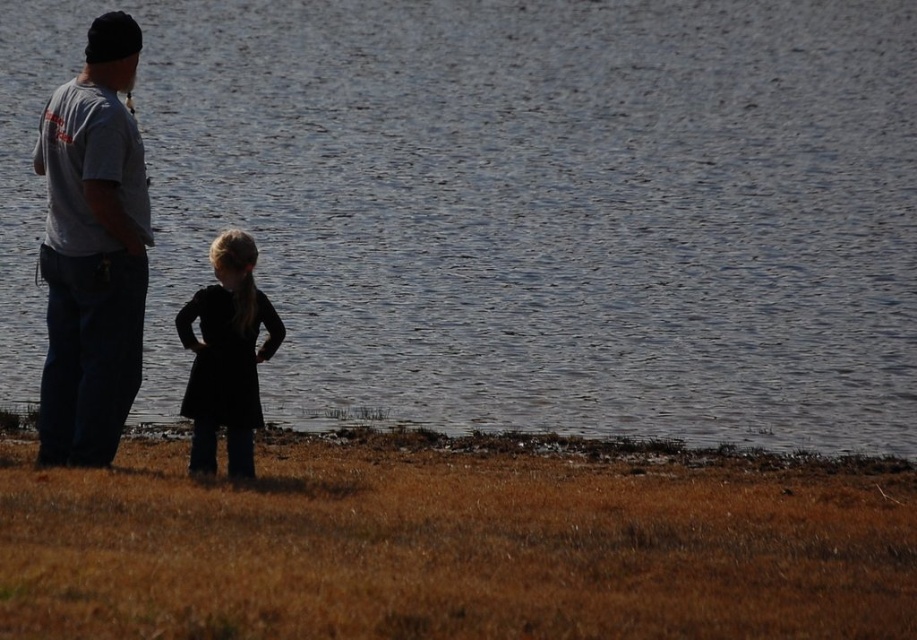
Question: Does glistening water at center have a smaller size compared to black matte dress at center?

Choices:
 (A) yes
 (B) no

Answer: (B)

Question: Considering the relative positions of glistening water at center and black matte dress at center in the image provided, where is glistening water at center located with respect to black matte dress at center?

Choices:
 (A) left
 (B) right

Answer: (B)

Question: Estimate the real-world distances between objects in this image. Which object is closer to the black matte dress at center?

Choices:
 (A) gray cotton shirt at left
 (B) glistening water at center

Answer: (A)

Question: Which object is the farthest from the black matte dress at center?

Choices:
 (A) gray cotton shirt at left
 (B) glistening water at center

Answer: (B)

Question: Which point is closer to the camera taking this photo?

Choices:
 (A) (560, 250)
 (B) (251, 259)

Answer: (B)

Question: Is gray cotton shirt at left below black matte dress at center?

Choices:
 (A) no
 (B) yes

Answer: (A)